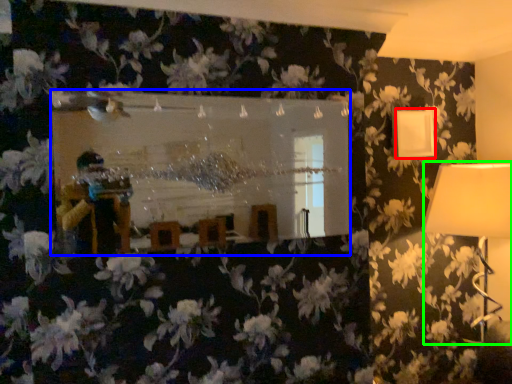
Question: Which is nearer to the lamp (highlighted by a red box)? mirror (highlighted by a blue box) or lamp (highlighted by a green box).

Choices:
 (A) mirror
 (B) lamp

Answer: (B)